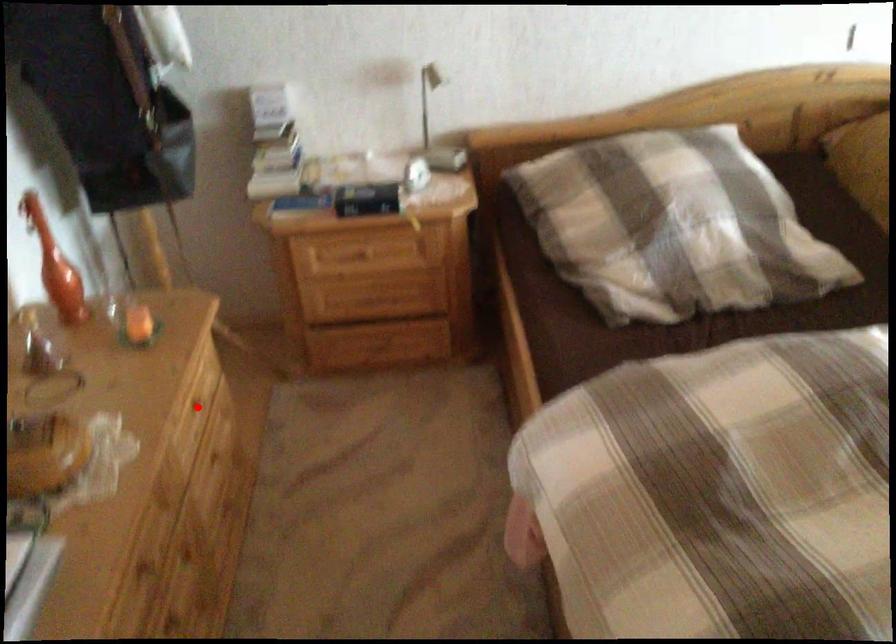
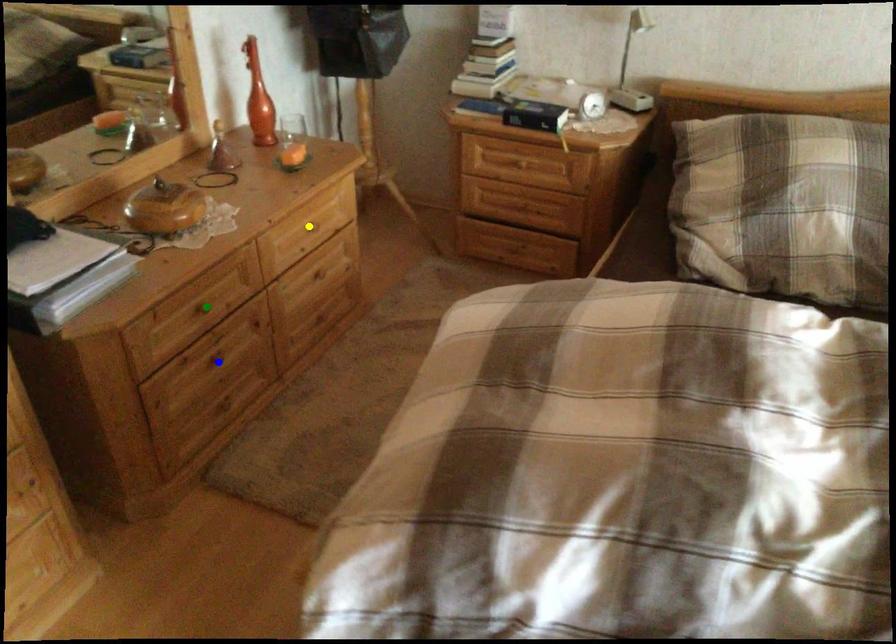
Question: I am providing you with two images of the same scene from different viewpoints. A red point is marked on the first image. You are given multiple points on the second image. Which mark in image 2 goes with the point in image 1?

Choices:
 (A) blue point
 (B) yellow point
 (C) green point

Answer: (B)